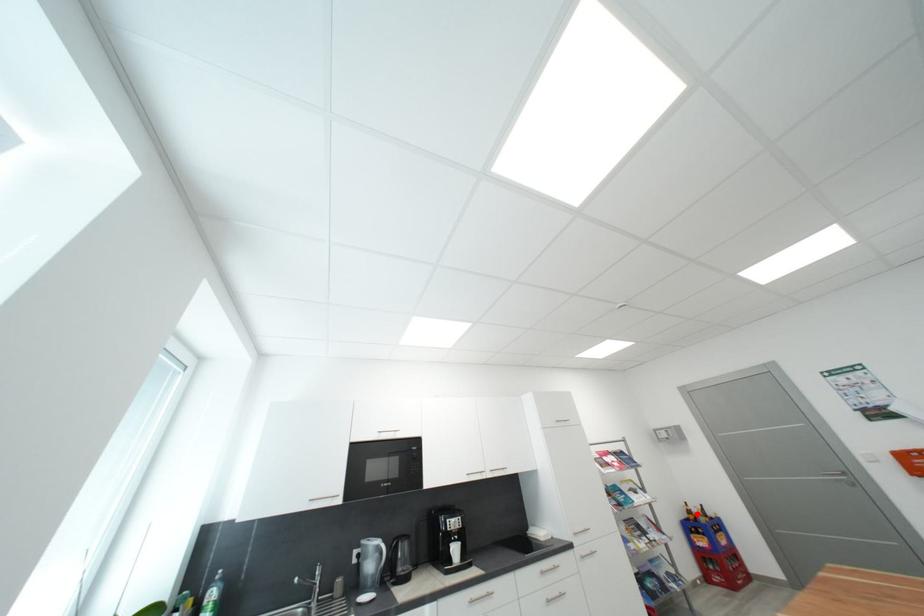
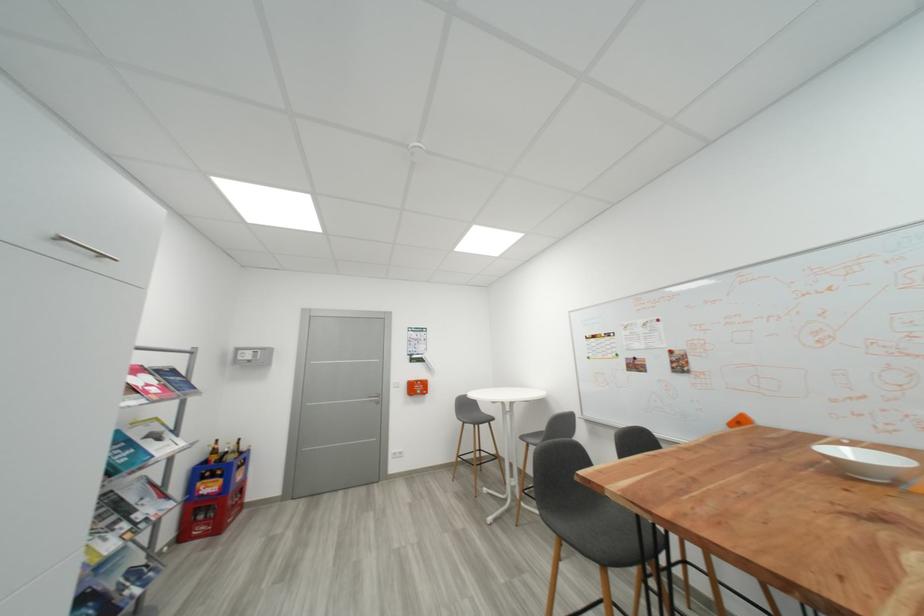
The point at the highlighted location is marked in the first image. Where is the corresponding point in the second image?

(223, 454)